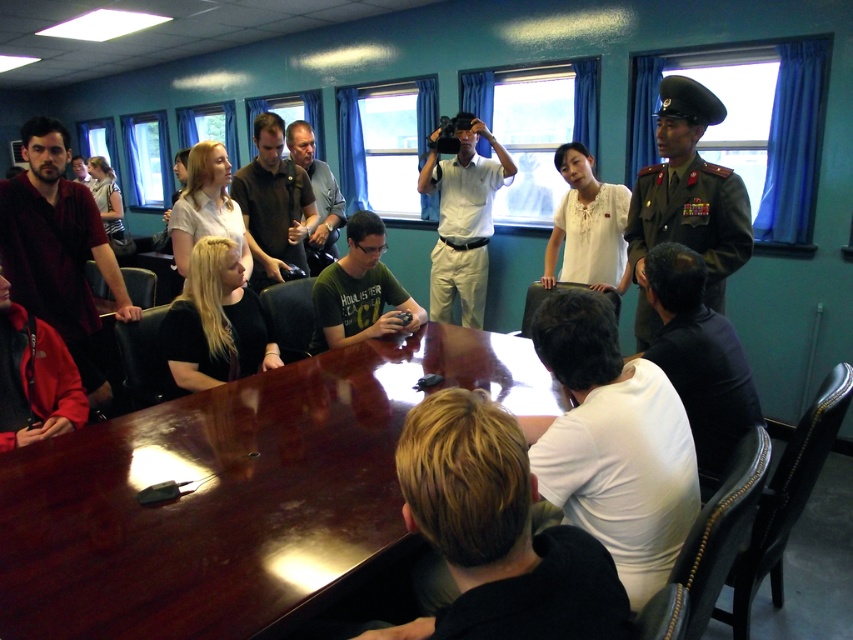
Is matte black shirt at left shorter than matte black microphone at center?

No, matte black shirt at left is not shorter than matte black microphone at center.

Is point (62, 282) farther from camera compared to point (299, 144)?

No, it is not.

You are a GUI agent. You are given a task and a screenshot of the screen. Output one action in this format:
    pyautogui.click(x=<x>, y=<y>)
    Task: Click on the matte black shirt at left
    The height and width of the screenshot is (640, 853).
    Given the screenshot: What is the action you would take?
    pyautogui.click(x=61, y=256)

Does glossy wood table at center appear on the right side of white matte shirt at lower center?

Incorrect, glossy wood table at center is not on the right side of white matte shirt at lower center.

How distant is glossy wood table at center from white matte shirt at lower center?

A distance of 63.03 centimeters exists between glossy wood table at center and white matte shirt at lower center.

Locate an element on the screen. Image resolution: width=853 pixels, height=640 pixels. glossy wood table at center is located at coordinates (234, 493).

Which is above, white cotton shirt at center or matte black microphone at center?

matte black microphone at center

Who is shorter, white cotton shirt at center or matte black microphone at center?

matte black microphone at center is shorter.

Is point (459, 246) positioned behind point (337, 252)?

That is False.

Where is `white cotton shirt at center`? white cotton shirt at center is located at coordinates (462, 220).